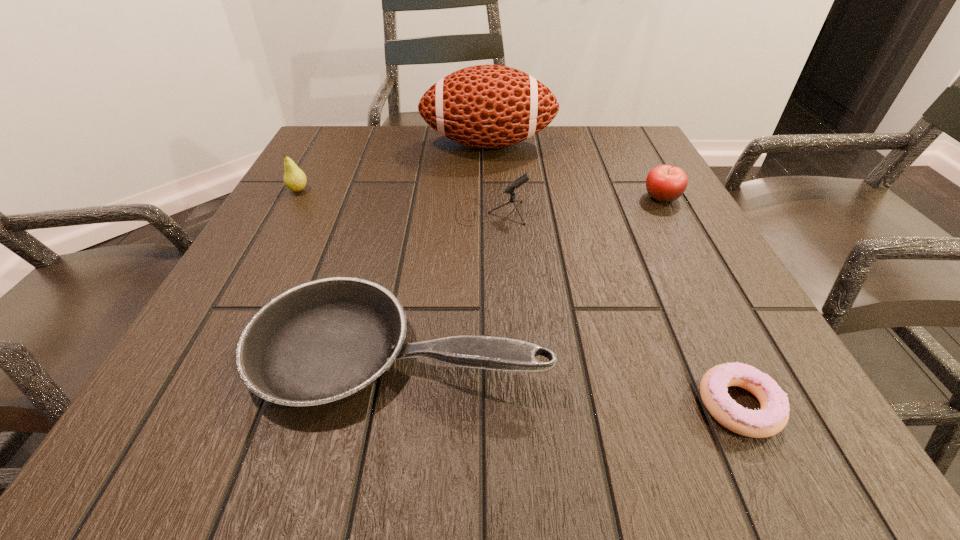
Where is `apple situated at the right edge`? apple situated at the right edge is located at coordinates (664, 183).

This screenshot has height=540, width=960. Find the location of `doughnut present at the right edge`. doughnut present at the right edge is located at coordinates (773, 416).

Find the location of a particular element. The image size is (960, 540). object present at the near left corner is located at coordinates (321, 342).

Locate an element on the screen. This screenshot has width=960, height=540. object that is at the near right corner is located at coordinates (773, 416).

In the image, there is a desktop. At what (x,y) coordinates should I click in order to perform the action: click on blank space at the far edge. Please return your answer as a coordinate pair (x, y). The image size is (960, 540). Looking at the image, I should click on (546, 143).

What are the coordinates of `free space at the near edge of the desktop` in the screenshot? It's located at (396, 396).

The width and height of the screenshot is (960, 540). I want to click on free space at the left edge, so click(x=282, y=278).

Where is `free space at the right edge of the desktop`? This screenshot has height=540, width=960. free space at the right edge of the desktop is located at coordinates (708, 283).

Locate an element on the screen. free spot at the far left corner of the desktop is located at coordinates (349, 130).

Find the location of a particular element. vacant space at the far right corner of the desktop is located at coordinates (607, 130).